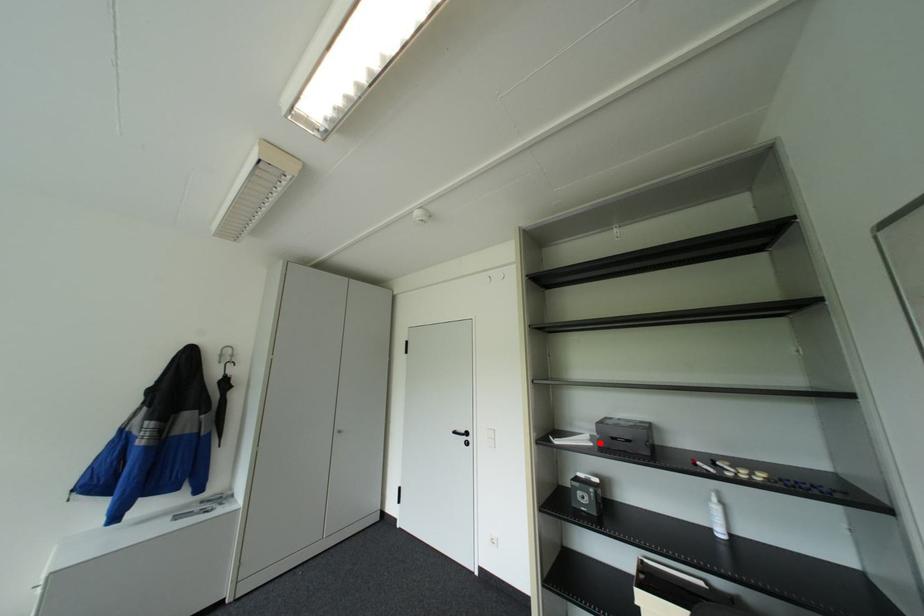
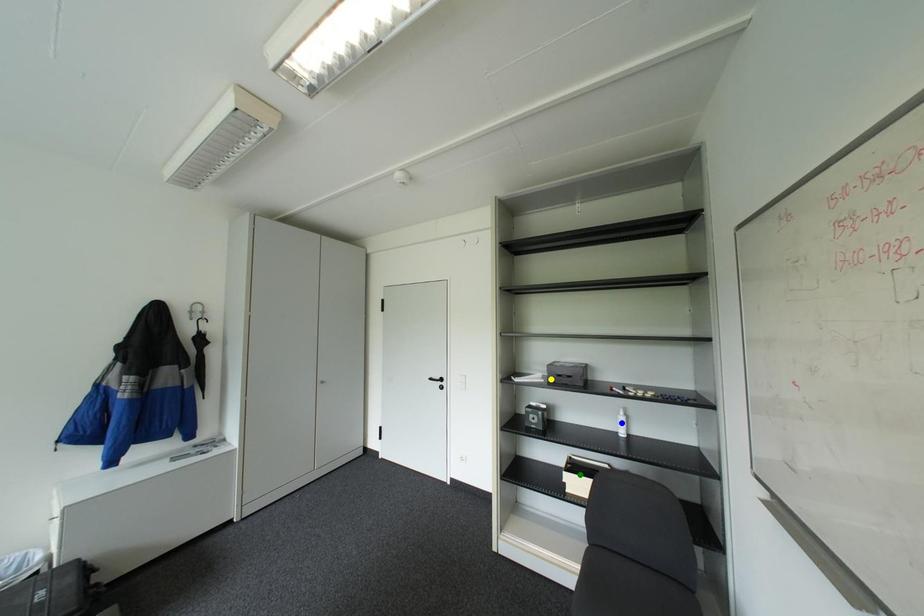
Question: I am providing you with two images of the same scene from different viewpoints. A red point is marked on the first image. You are given multiple points on the second image. Which point in image 2 represents the same 3d spot as the red point in image 1?

Choices:
 (A) blue point
 (B) green point
 (C) yellow point

Answer: (C)